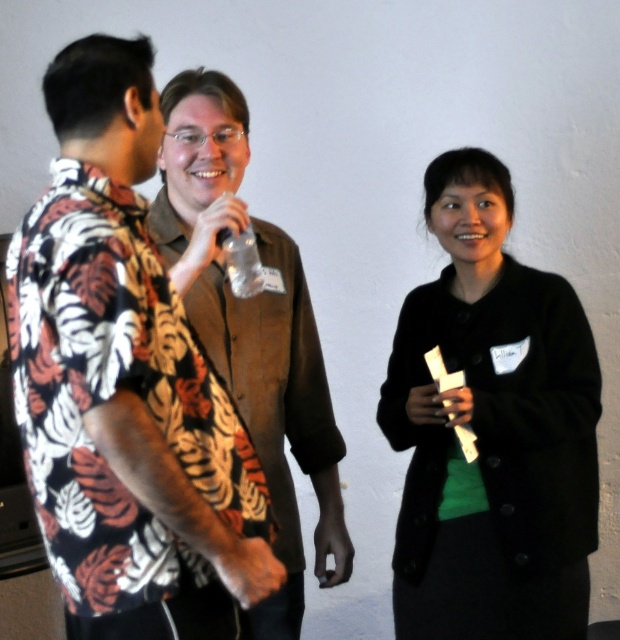
Looking at the scene, which object is positioned to the left of the other between the floral fabric shirt at left and the clear plastic bottle at center?

The floral fabric shirt at left is positioned to the left of the clear plastic bottle at center.

You are organizing a charity event and need to decide which item to donate first between the floral fabric shirt at left and the clear plastic bottle at center. Based on their sizes, which one should you prioritize for donation?

The floral fabric shirt at left is bigger than the clear plastic bottle at center, so you should prioritize donating the floral fabric shirt at left first because it takes up more space.